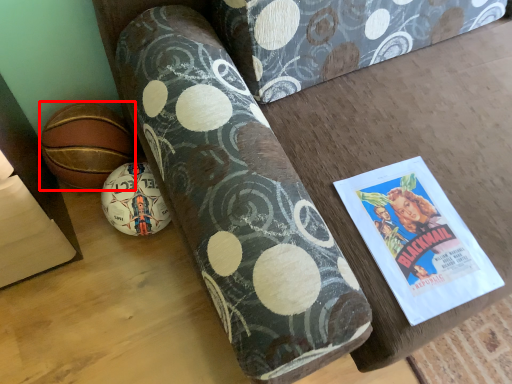
Question: From the image's perspective, considering the relative positions of ball (annotated by the red box) and ball in the image provided, where is ball (annotated by the red box) located with respect to the staircase?

Choices:
 (A) above
 (B) below

Answer: (A)